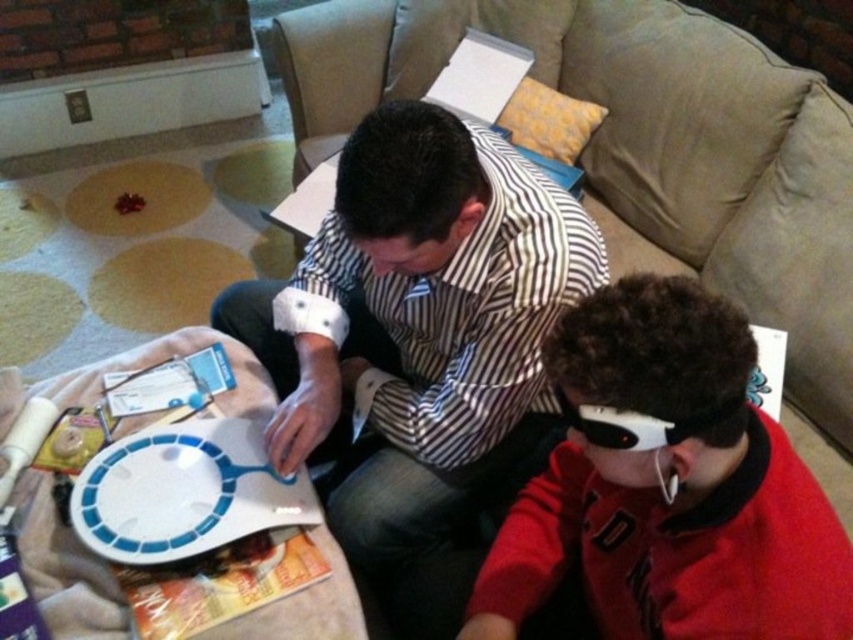
Question: Does striped fabric shirt at center have a smaller size compared to beige fabric couch at center?

Choices:
 (A) yes
 (B) no

Answer: (A)

Question: Which point is farther to the camera?

Choices:
 (A) red matte glasses at center
 (B) striped fabric shirt at center
 (C) beige fabric couch at center
 (D) white plastic platter at center

Answer: (C)

Question: Which point is farther from the camera taking this photo?

Choices:
 (A) (746, 488)
 (B) (491, 179)
 (C) (543, 65)
 (D) (154, 465)

Answer: (C)

Question: Is beige fabric couch at center to the right of white plastic platter at center from the viewer's perspective?

Choices:
 (A) yes
 (B) no

Answer: (A)

Question: Is beige fabric couch at center bigger than red matte glasses at center?

Choices:
 (A) yes
 (B) no

Answer: (A)

Question: Which object is farther from the camera taking this photo?

Choices:
 (A) beige fabric couch at center
 (B) striped fabric shirt at center
 (C) red matte glasses at center
 (D) white plastic platter at center

Answer: (A)